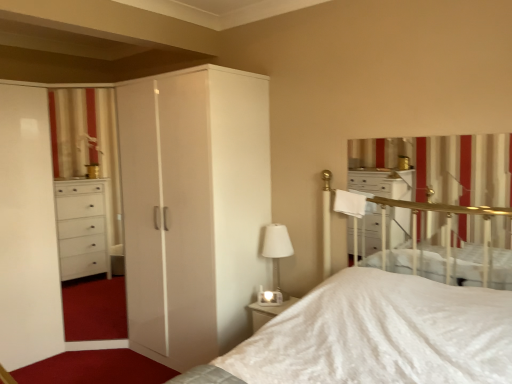
Question: Is white striped curtain at upper right at the back of white glass table lamp at center?

Choices:
 (A) no
 (B) yes

Answer: (A)

Question: Is white glass table lamp at center surrounding white striped curtain at upper right?

Choices:
 (A) yes
 (B) no

Answer: (B)

Question: Does white glass table lamp at center come in front of white striped curtain at upper right?

Choices:
 (A) yes
 (B) no

Answer: (B)

Question: Does white glass table lamp at center have a larger size compared to white striped curtain at upper right?

Choices:
 (A) yes
 (B) no

Answer: (B)

Question: From the image's perspective, does white glass table lamp at center appear higher than white striped curtain at upper right?

Choices:
 (A) no
 (B) yes

Answer: (A)

Question: Considering the relative sizes of white glass table lamp at center and white striped curtain at upper right in the image provided, is white glass table lamp at center wider than white striped curtain at upper right?

Choices:
 (A) no
 (B) yes

Answer: (B)

Question: Considering the relative sizes of white glossy wardrobe at center and white striped curtain at upper right in the image provided, is white glossy wardrobe at center taller than white striped curtain at upper right?

Choices:
 (A) no
 (B) yes

Answer: (B)

Question: From the image's perspective, would you say white glossy wardrobe at center is shown under white striped curtain at upper right?

Choices:
 (A) no
 (B) yes

Answer: (B)

Question: Could you tell me if white glossy wardrobe at center is facing white striped curtain at upper right?

Choices:
 (A) no
 (B) yes

Answer: (A)

Question: Is white glossy wardrobe at center placed right next to white striped curtain at upper right?

Choices:
 (A) no
 (B) yes

Answer: (A)

Question: Is white glossy wardrobe at center far from white striped curtain at upper right?

Choices:
 (A) yes
 (B) no

Answer: (A)

Question: Is white glossy wardrobe at center at the left side of white striped curtain at upper right?

Choices:
 (A) yes
 (B) no

Answer: (A)

Question: Could you tell me if white striped curtain at upper right is facing white glass table lamp at center?

Choices:
 (A) no
 (B) yes

Answer: (A)